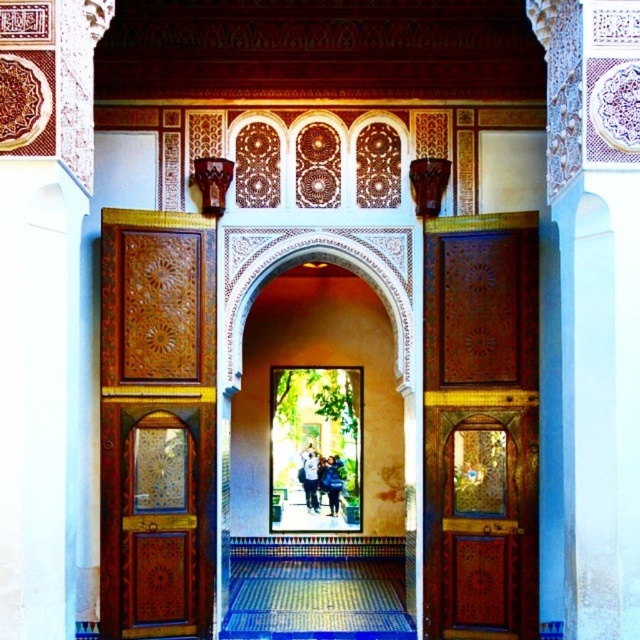
Can you confirm if polished wood door at right is positioned to the right of polished wood door at left?

Yes, polished wood door at right is to the right of polished wood door at left.

Which is more to the right, polished wood door at right or polished wood door at left?

polished wood door at right is more to the right.

Who is more forward, (433, 500) or (172, 611)?

Point (172, 611) is in front.

You are a GUI agent. You are given a task and a screenshot of the screen. Output one action in this format:
    pyautogui.click(x=<x>, y=<y>)
    Task: Click on the polished wood door at right
    The width and height of the screenshot is (640, 640).
    Given the screenshot: What is the action you would take?
    pyautogui.click(x=481, y=426)

Can you confirm if polished wood door at right is wider than light blue jeans at center?

Yes, polished wood door at right is wider than light blue jeans at center.

Who is lower down, polished wood door at right or light blue jeans at center?

light blue jeans at center is lower down.

The height and width of the screenshot is (640, 640). Describe the element at coordinates (481, 426) in the screenshot. I see `polished wood door at right` at that location.

Where is `polished wood door at right`? The width and height of the screenshot is (640, 640). polished wood door at right is located at coordinates (481, 426).

This screenshot has height=640, width=640. In order to click on polished wood door at left in this screenshot , I will do `click(157, 529)`.

Does point (177, 620) lie in front of point (310, 502)?

Yes, point (177, 620) is in front of point (310, 502).

Locate an element on the screen. The height and width of the screenshot is (640, 640). polished wood door at left is located at coordinates (157, 529).